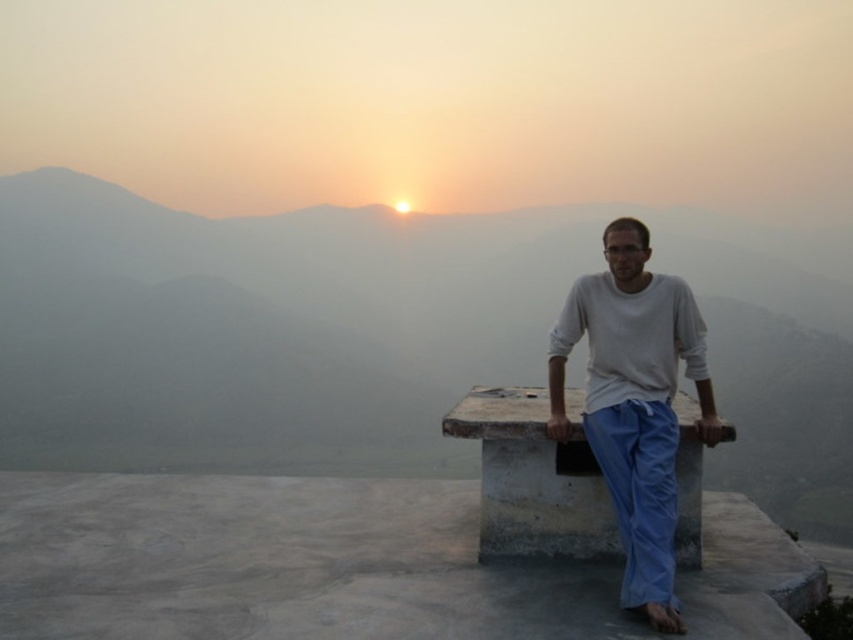
You are standing on the concrete platform where the man is leaning. You want to sit down on the gray stone bench at center. In which direction should you walk to reach the bench?

The gray stone bench at center is located at point (259, 320), so you should walk forward from the concrete platform to reach the bench.

You are a photographer trying to capture a photo of the gray stone bench at center and the white cotton shirt at center. Since the sun is low in the sky, you want to ensure that the bench is not casting a shadow over the shirt in the photo. Based on their heights, which object is more likely to cast a shadow over the other?

The gray stone bench at center is much taller than the white cotton shirt at center, so the bench is more likely to cast a shadow over the shirt.